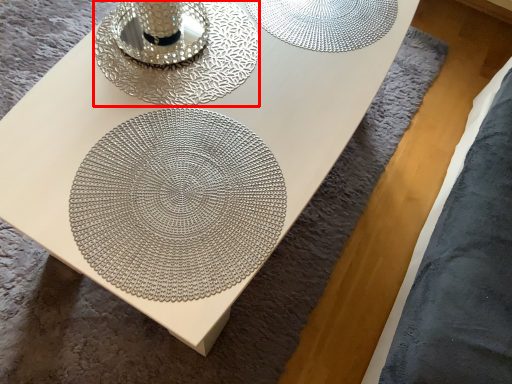
Question: Where is candle holder (annotated by the red box) located in relation to mandala in the image?

Choices:
 (A) right
 (B) left

Answer: (B)